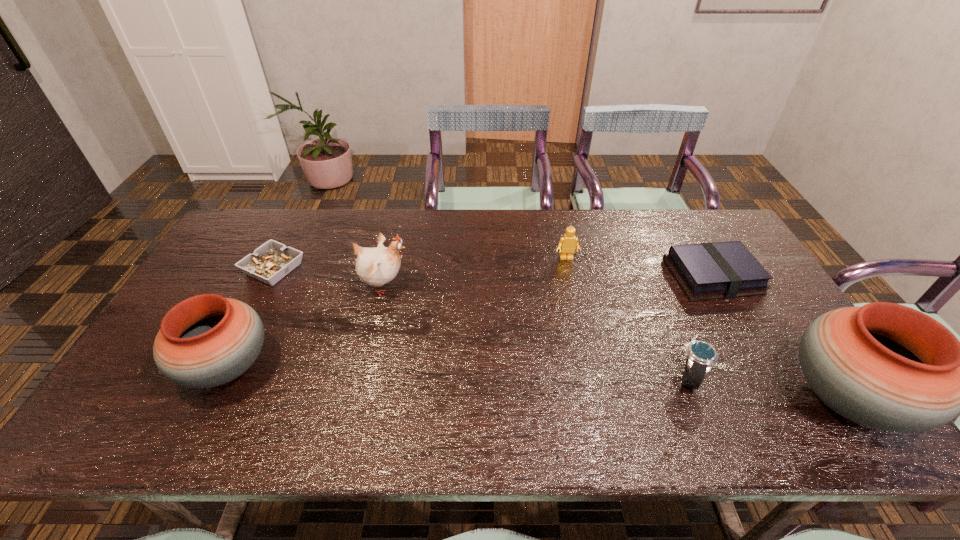
This screenshot has width=960, height=540. I want to click on empty space between the Lego and the bird, so click(475, 272).

The image size is (960, 540). I want to click on vacant region between the book and the fifth object from right to left, so click(548, 281).

This screenshot has width=960, height=540. I want to click on free spot between the shortest object and the fifth object from left to right, so click(x=481, y=322).

This screenshot has width=960, height=540. Find the location of `free spot between the watch and the left pottery`. free spot between the watch and the left pottery is located at coordinates (459, 372).

You are a GUI agent. You are given a task and a screenshot of the screen. Output one action in this format:
    pyautogui.click(x=<x>, y=<y>)
    Task: Click on the free area in between the ashtray and the fifth tallest object
    Image resolution: width=960 pixels, height=540 pixels.
    Given the screenshot: What is the action you would take?
    pyautogui.click(x=481, y=322)

You are a GUI agent. You are given a task and a screenshot of the screen. Output one action in this format:
    pyautogui.click(x=<x>, y=<y>)
    Task: Click on the vacant point located between the fifth tallest object and the tallest object
    The image size is (960, 540).
    Given the screenshot: What is the action you would take?
    [767, 387]

At what (x,y) coordinates should I click in order to perform the action: click on free space between the bird and the watch. Please return your answer as a coordinate pair (x, y). Looking at the image, I should click on (537, 330).

Image resolution: width=960 pixels, height=540 pixels. I want to click on free space between the Lego and the shorter pottery, so click(x=397, y=313).

Where is `vacant region between the shortest object and the bird`? Image resolution: width=960 pixels, height=540 pixels. vacant region between the shortest object and the bird is located at coordinates (328, 277).

Locate which object ranks second in proximity to the shortest object. Please provide its 2D coordinates. Your answer should be formatted as a tuple, i.e. [(x, y)], where the tuple contains the x and y coordinates of a point satisfying the conditions above.

[(377, 266)]